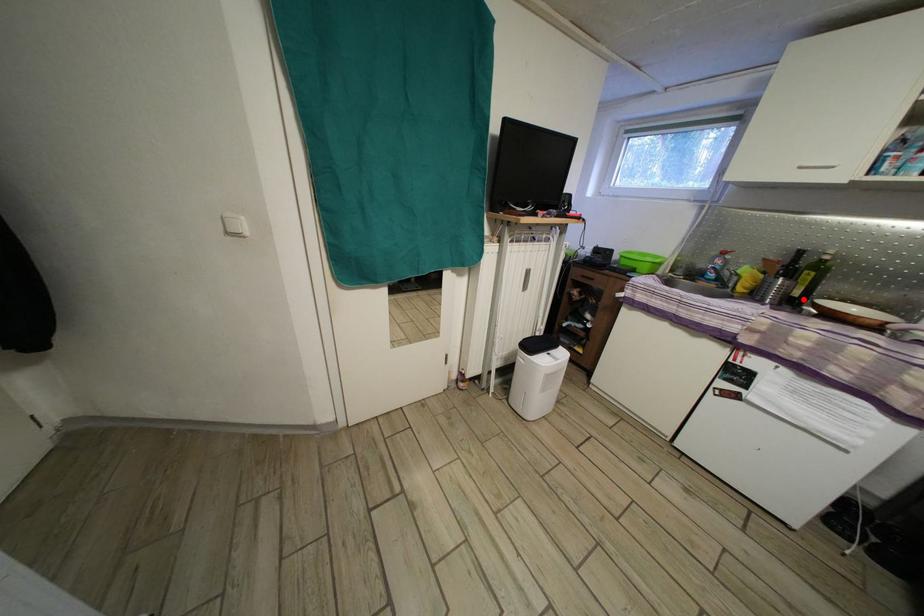
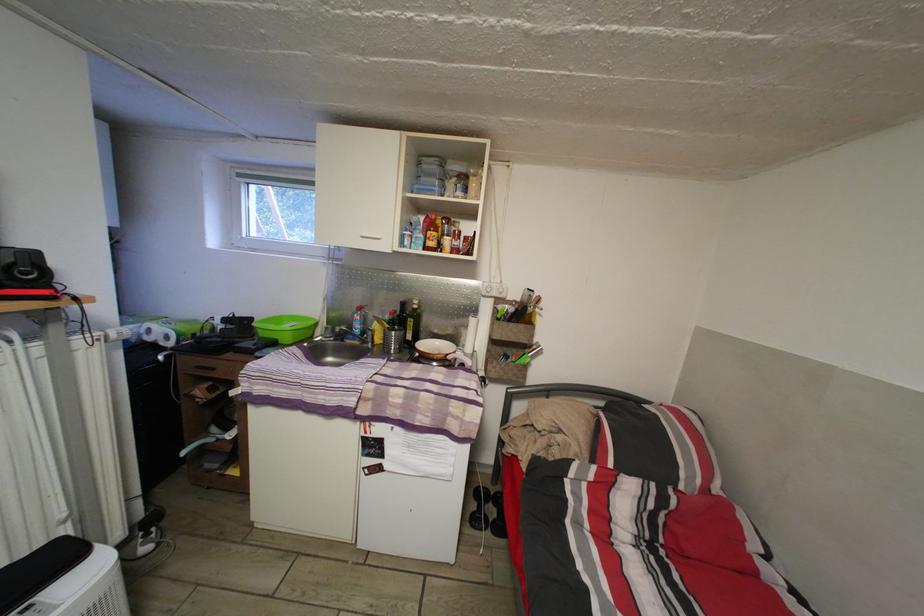
Question: I am providing you with two images of the same scene from different viewpoints. A red point is marked on the first image. Is the red point's position out of view in image 2?

Choices:
 (A) Yes
 (B) No

Answer: (B)